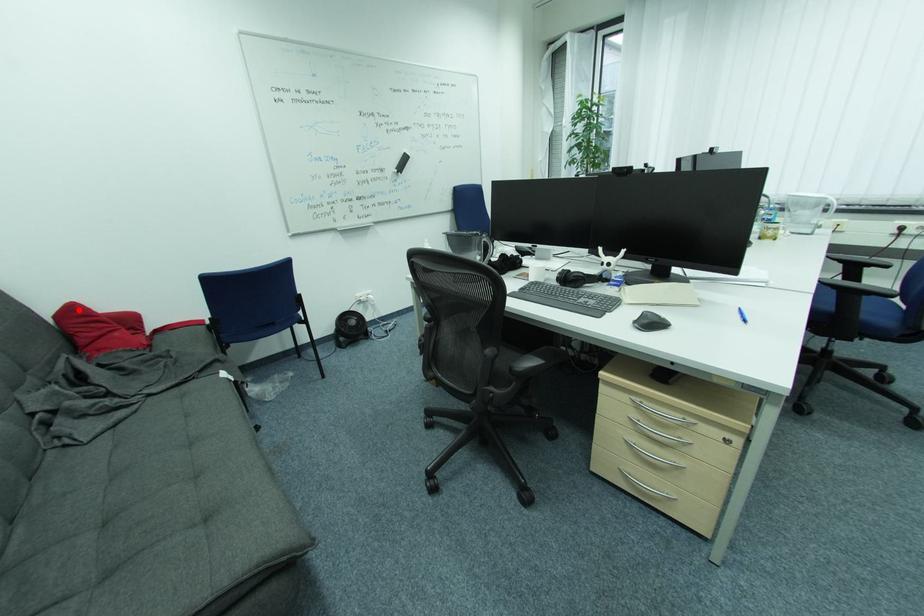
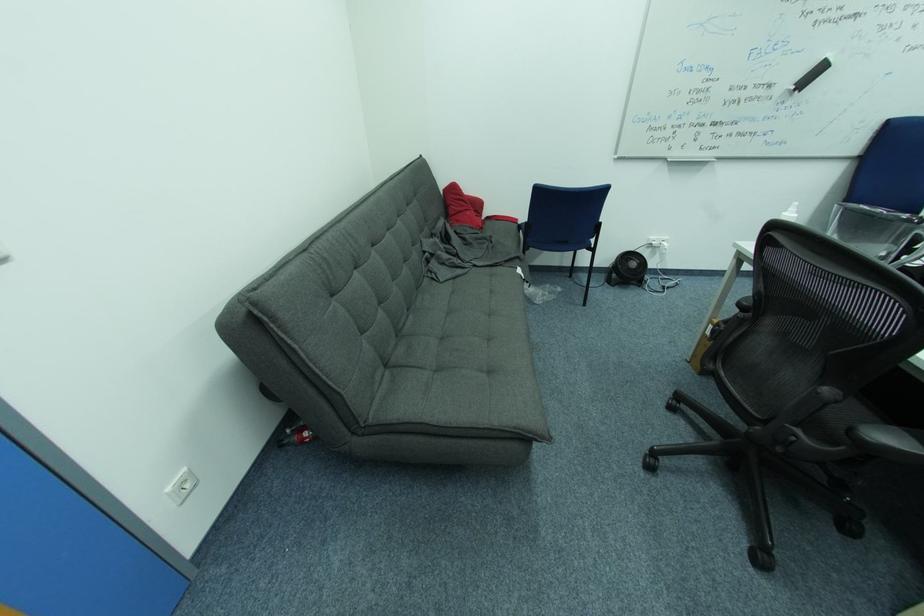
Question: A red point is marked in image1. In image2, is the corresponding 3D point closer to the camera or farther? Reply with the corresponding letter.

Choices:
 (A) The corresponding 3D point is closer.
 (B) The corresponding 3D point is farther.

Answer: (A)